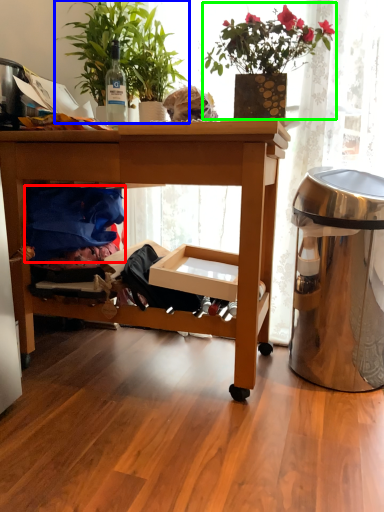
Question: Based on their relative distances, which object is farther from clothing (highlighted by a red box)? Choose from houseplant (highlighted by a blue box) and houseplant (highlighted by a green box).

Choices:
 (A) houseplant
 (B) houseplant

Answer: (B)